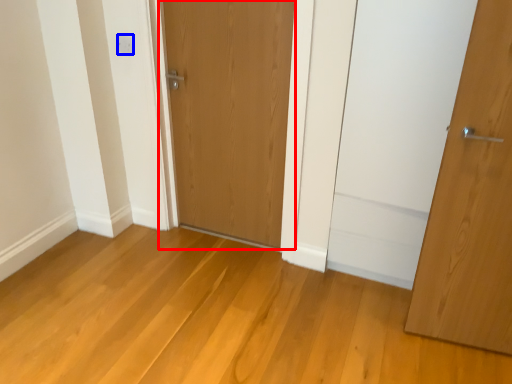
Question: Among these objects, which one is farthest to the camera, door (highlighted by a red box) or electric outlet (highlighted by a blue box)?

Choices:
 (A) door
 (B) electric outlet

Answer: (B)